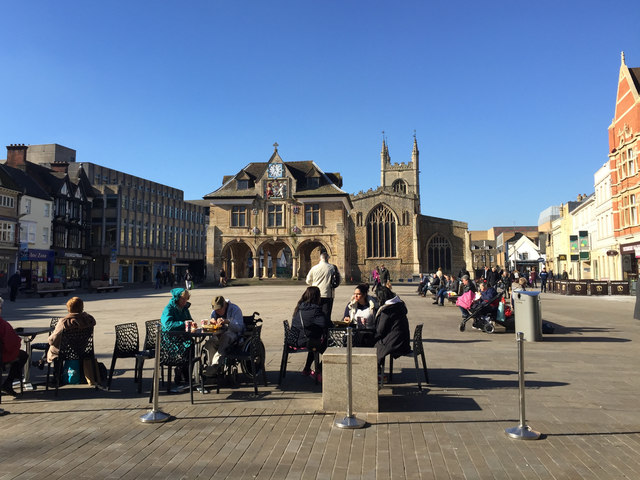
Find the location of a particular element. The width and height of the screenshot is (640, 480). metal chair is located at coordinates (408, 352), (339, 332), (288, 336), (171, 357), (152, 330), (128, 344), (84, 352), (58, 323), (11, 367).